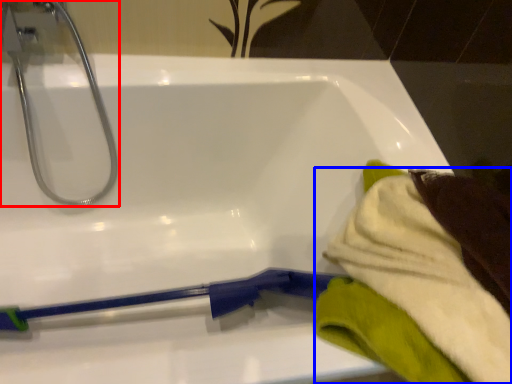
Question: Which point is further to the camera, tap (highlighted by a red box) or bath towel (highlighted by a blue box)?

Choices:
 (A) tap
 (B) bath towel

Answer: (A)